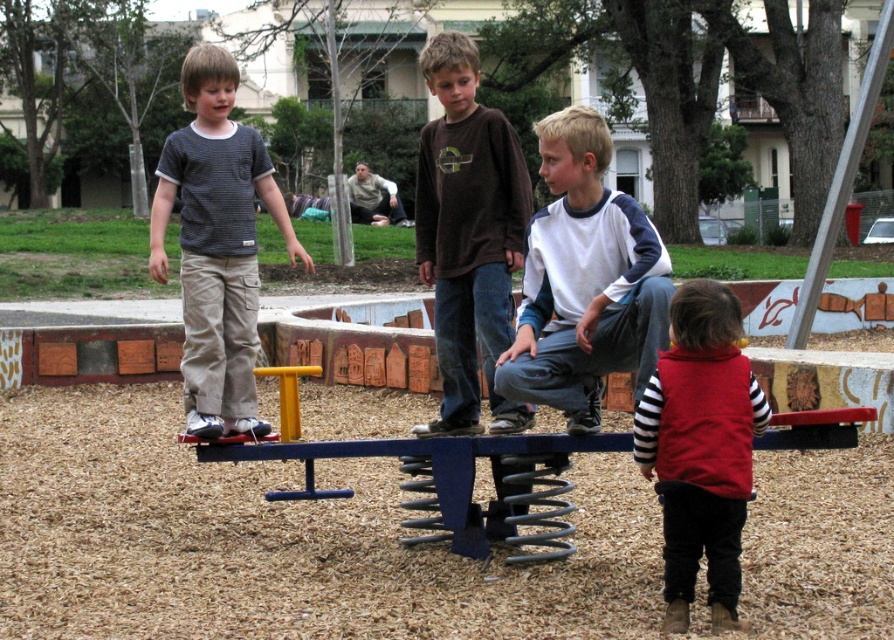
Question: Can you confirm if striped cotton shirt at center is wider than red fleece vest at lower right?

Choices:
 (A) no
 (B) yes

Answer: (B)

Question: Does brown cotton shirt at center appear over red fleece vest at lower right?

Choices:
 (A) no
 (B) yes

Answer: (B)

Question: Considering the real-world distances, which object is closest to the red fleece vest at lower right?

Choices:
 (A) white/blue long-sleeve shirt at center
 (B) brown cotton shirt at center

Answer: (A)

Question: Which point is farther from the camera taking this photo?

Choices:
 (A) (673, 554)
 (B) (453, 160)
 (C) (230, 230)

Answer: (C)

Question: Does brown cotton shirt at center appear on the right side of red fleece vest at lower right?

Choices:
 (A) yes
 (B) no

Answer: (B)

Question: Which of the following is the farthest from the observer?

Choices:
 (A) (600, 280)
 (B) (745, 392)

Answer: (A)